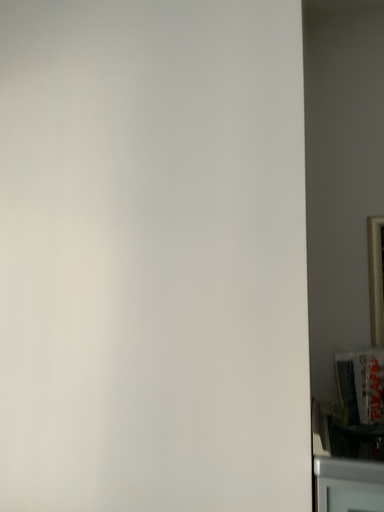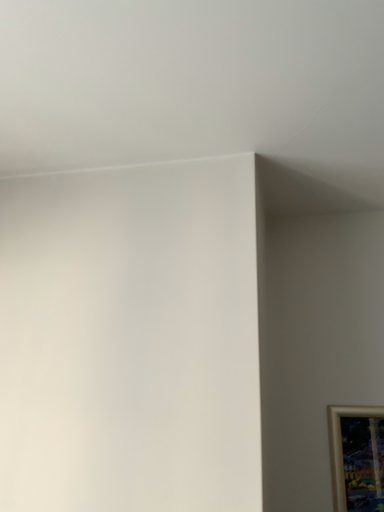
Question: How did the camera likely rotate when shooting the video?

Choices:
 (A) rotated downward
 (B) rotated upward

Answer: (B)